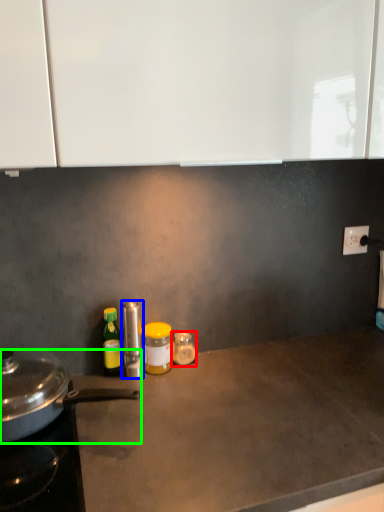
Question: Estimate the real-world distances between objects in this image. Which object is closer to bottle (highlighted by a red box), kitchen appliance (highlighted by a blue box) or kitchen appliance (highlighted by a green box)?

Choices:
 (A) kitchen appliance
 (B) kitchen appliance

Answer: (A)